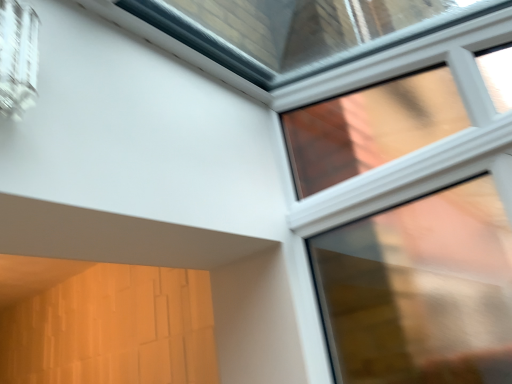
At what (x,y) coordinates should I click in order to perform the action: click on white glossy poster at upper left. Please return your answer as a coordinate pair (x, y). Looking at the image, I should click on (18, 57).

What do you see at coordinates (18, 57) in the screenshot?
I see `white glossy poster at upper left` at bounding box center [18, 57].

Find the location of a particular element. The width and height of the screenshot is (512, 384). white glossy poster at upper left is located at coordinates (18, 57).